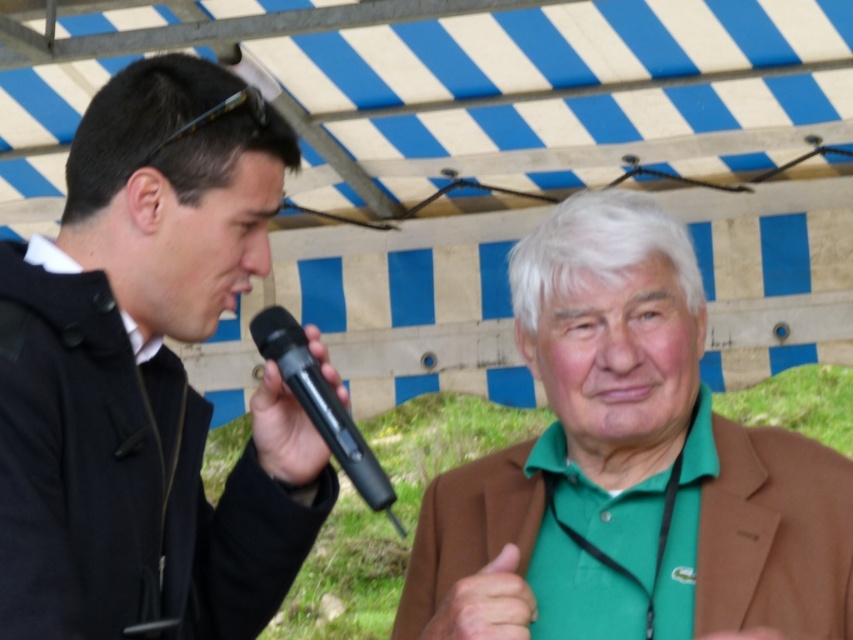
Who is taller, black plastic microphone at left or green matte hand at center?

Standing taller between the two is black plastic microphone at left.

Does black plastic microphone at left appear over green matte hand at center?

Yes, black plastic microphone at left is above green matte hand at center.

Does point (262, 412) come farther from viewer compared to point (521, 579)?

Yes, it is.

Identify the location of black plastic microphone at left. The height and width of the screenshot is (640, 853). (283, 432).

Is point (482, 570) farther from viewer compared to point (326, 349)?

No, (482, 570) is closer to viewer.

Does green fabric shirt at right have a greater width compared to black plastic microphone at left?

Yes, green fabric shirt at right is wider than black plastic microphone at left.

The width and height of the screenshot is (853, 640). I want to click on green fabric shirt at right, so click(x=628, y=465).

Who is lower down, black plastic microphone at center or black plastic microphone at left?

black plastic microphone at center is lower down.

Does point (311, 384) come behind point (305, 477)?

No, it is not.

Locate an element on the screen. This screenshot has height=640, width=853. black plastic microphone at center is located at coordinates (322, 404).

This screenshot has width=853, height=640. I want to click on black plastic microphone at center, so click(322, 404).